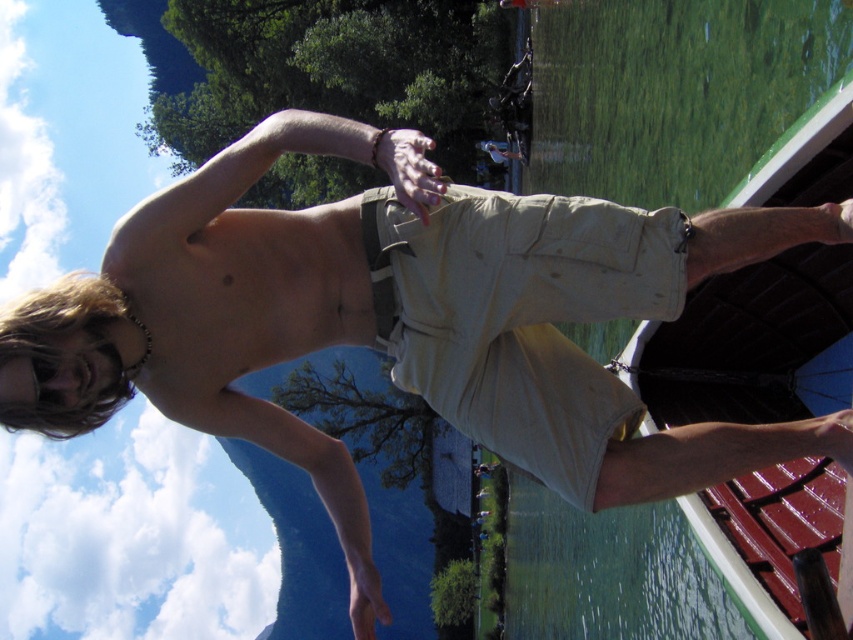
Question: Is green smooth water at lower right smaller than khaki cotton shorts at center?

Choices:
 (A) no
 (B) yes

Answer: (A)

Question: Which point appears farthest from the camera in this image?

Choices:
 (A) (527, 305)
 (B) (816, 344)

Answer: (B)

Question: Is green smooth water at lower right wider than khaki cotton shorts at center?

Choices:
 (A) no
 (B) yes

Answer: (B)

Question: Which object appears closest to the camera in this image?

Choices:
 (A) green smooth water at lower right
 (B) khaki cotton shorts at center

Answer: (B)

Question: In this image, where is green smooth water at lower right located relative to khaki cotton shorts at center?

Choices:
 (A) below
 (B) above

Answer: (A)